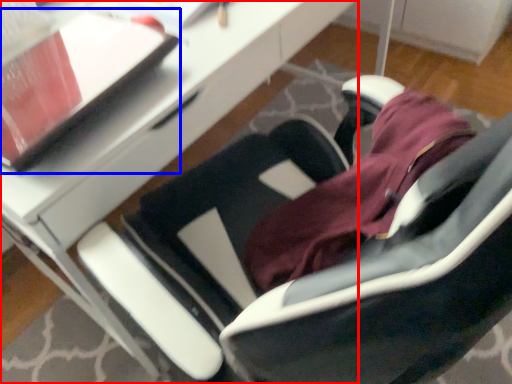
Question: Which point is closer to the camera, desk (highlighted by a red box) or notepad (highlighted by a blue box)?

Choices:
 (A) desk
 (B) notepad

Answer: (B)